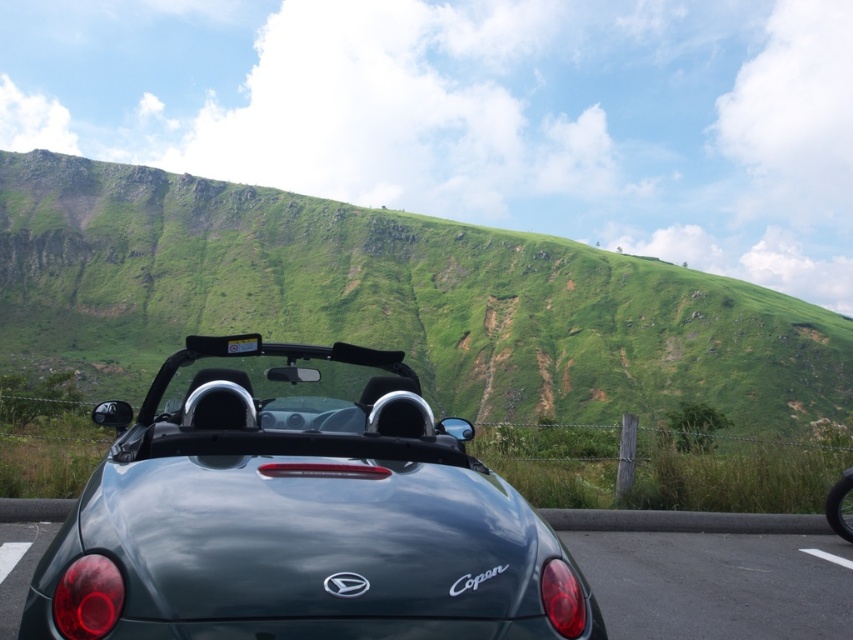
You are standing next to the convertible car parked on the road and want to take a photo of the green grassy hillside at center. Where should you point your camera to capture it in the frame?

The green grassy hillside at center is located at coordinates point (393, 300), so you should point your camera towards that position to capture it in the frame.

You are a photographer planning to take a picture of the glossy dark green car at lower center and the green grassy hillside at center. Which object should you focus on first if you want to capture both in a single frame without moving the camera?

The green grassy hillside at center is positioned on the left side of the glossy dark green car at lower center, so you should focus on the glossy dark green car at lower center first as it is closer to the camera. This way, both objects will be in focus within the same frame.

You are a photographer setting up a tripod to capture the satin black convertible at center and the shiny black tire at lower right. Since you want to include both in the frame without cropping, which object should you position closer to the camera to ensure both are fully visible?

The satin black convertible at center is taller than the shiny black tire at lower right. To include both in the frame without cropping, position the shiny black tire at lower right closer to the camera so its height matches the convertible at center.